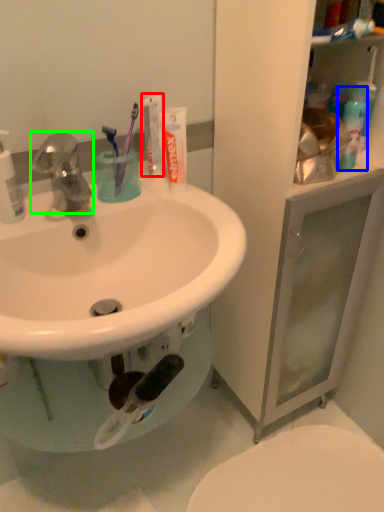
Question: Considering the real-world distances, which object is closest to toothpaste (highlighted by a red box)? cleaning product (highlighted by a blue box) or tap (highlighted by a green box).

Choices:
 (A) cleaning product
 (B) tap

Answer: (B)